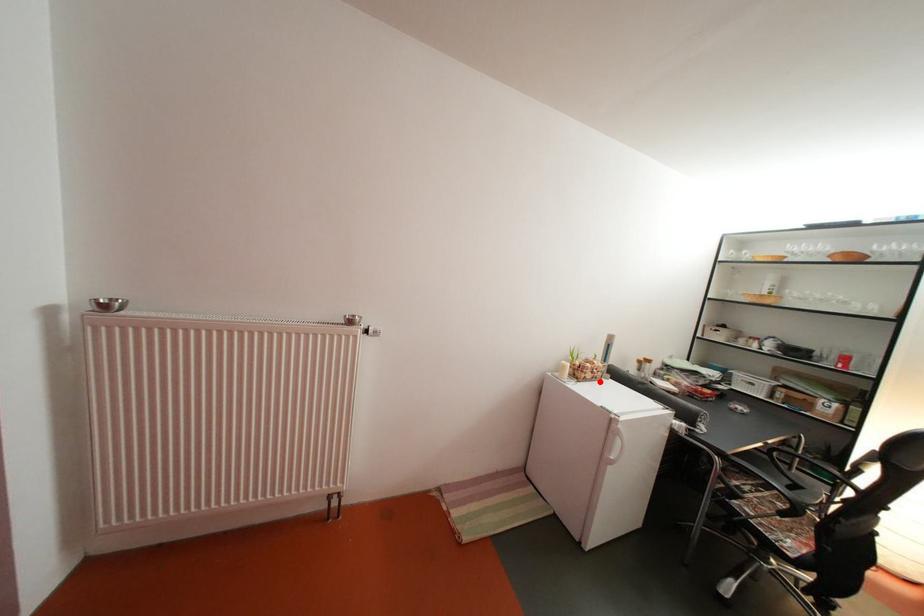
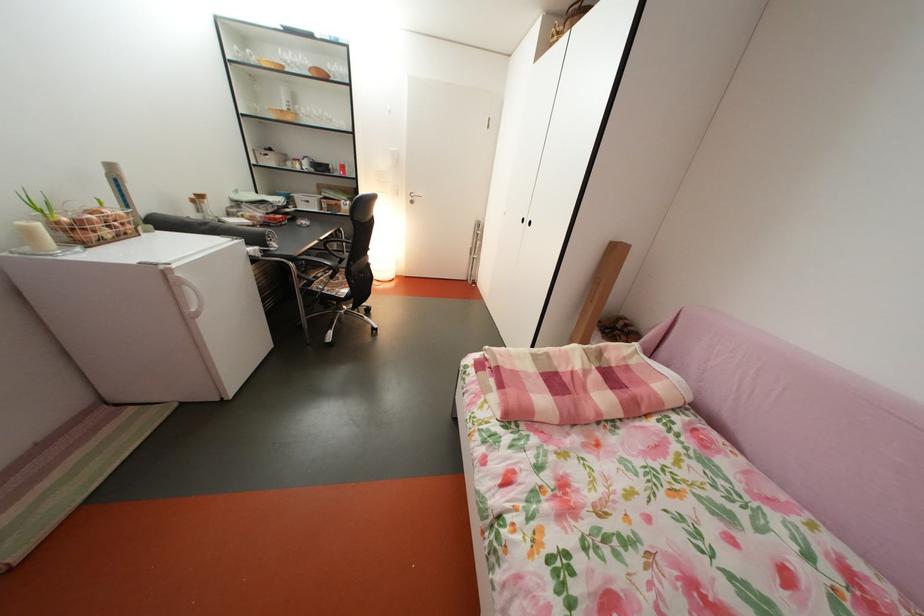
The point at the highlighted location is marked in the first image. Where is the corresponding point in the second image?

(118, 238)